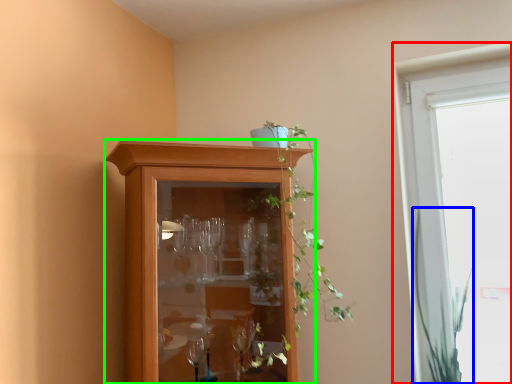
Question: Which is farther away from window (highlighted by a red box)? vegetation (highlighted by a blue box) or cupboard (highlighted by a green box)?

Choices:
 (A) vegetation
 (B) cupboard

Answer: (B)